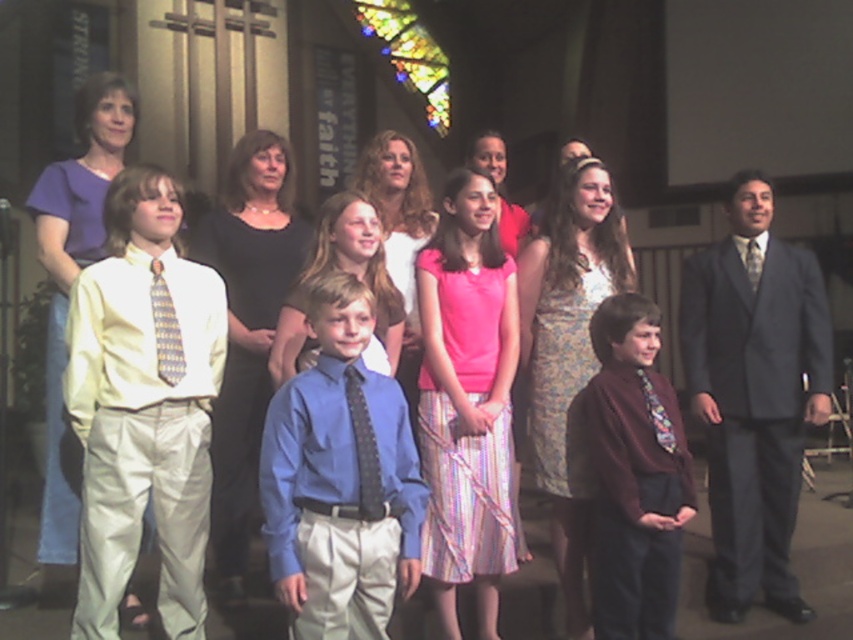
Question: Is matte yellow shirt at left wider than blue satin shirt at center?

Choices:
 (A) no
 (B) yes

Answer: (A)

Question: Where is matte yellow shirt at left located in relation to gray suit at right in the image?

Choices:
 (A) above
 (B) below

Answer: (A)

Question: Where is matte yellow shirt at left located in relation to gray suit at right in the image?

Choices:
 (A) left
 (B) right

Answer: (A)

Question: Which object is closer to the camera taking this photo?

Choices:
 (A) maroon sweater at center
 (B) gray suit at right

Answer: (A)

Question: Which is farther from the maroon sweater at center?

Choices:
 (A) gray suit at right
 (B) matte yellow shirt at left
 (C) blue satin shirt at center

Answer: (B)

Question: Which object is the farthest from the gray suit at right?

Choices:
 (A) maroon sweater at center
 (B) blue satin shirt at center

Answer: (B)